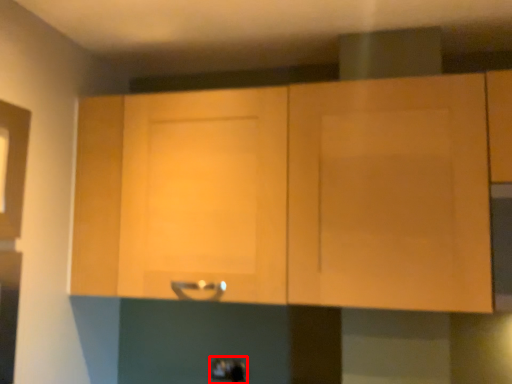
Question: Observing the image, what is the correct spatial positioning of door handle (annotated by the red box) in reference to cabinetry?

Choices:
 (A) right
 (B) left

Answer: (B)